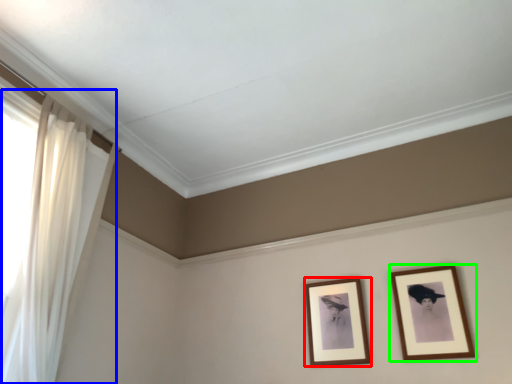
Question: Which is farther away from picture frame (highlighted by a red box)? curtain (highlighted by a blue box) or picture frame (highlighted by a green box)?

Choices:
 (A) curtain
 (B) picture frame

Answer: (A)